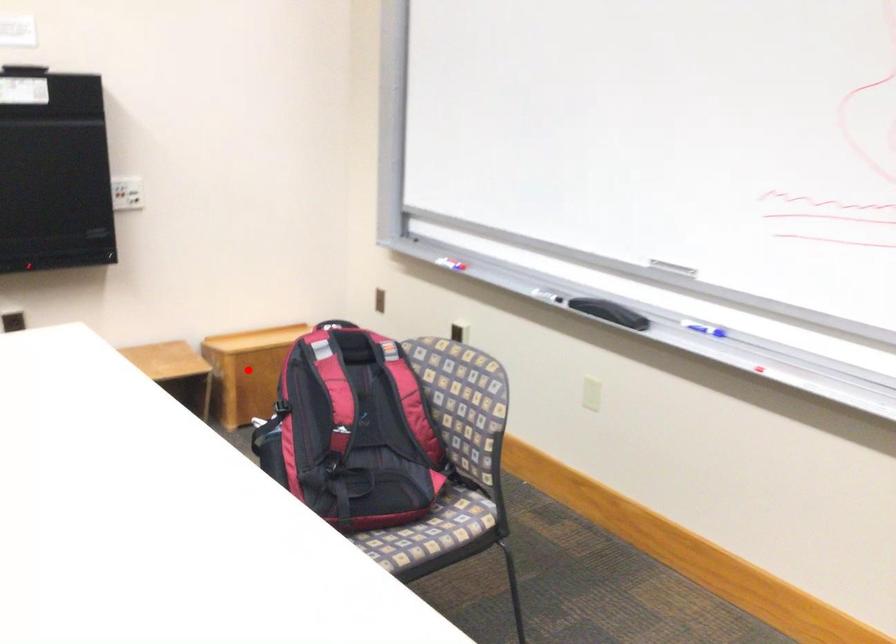
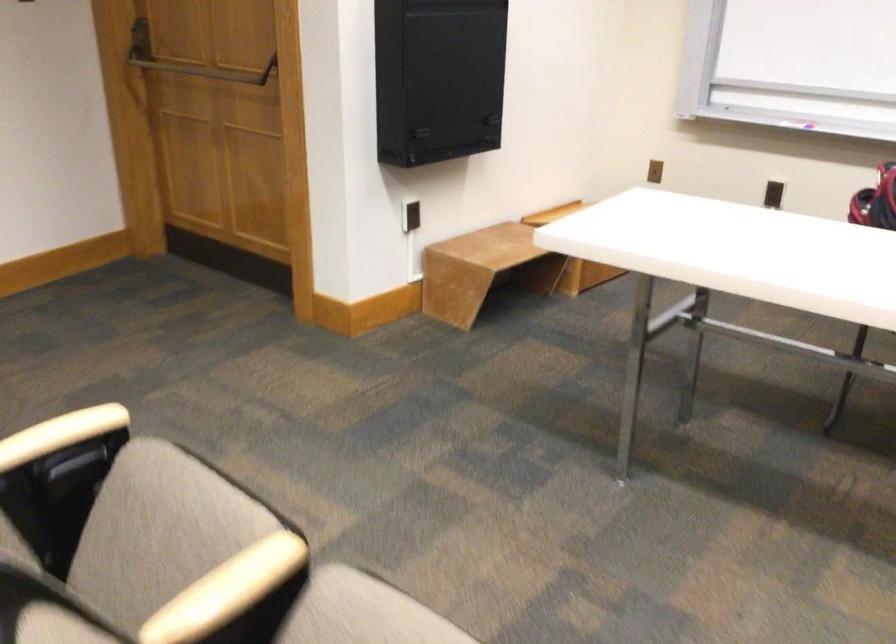
Question: I am providing you with two images of the same scene from different viewpoints. A red point is marked on the first image. At the location where the point appears in image 1, is it still visible in image 2?

Choices:
 (A) Yes
 (B) No

Answer: (B)